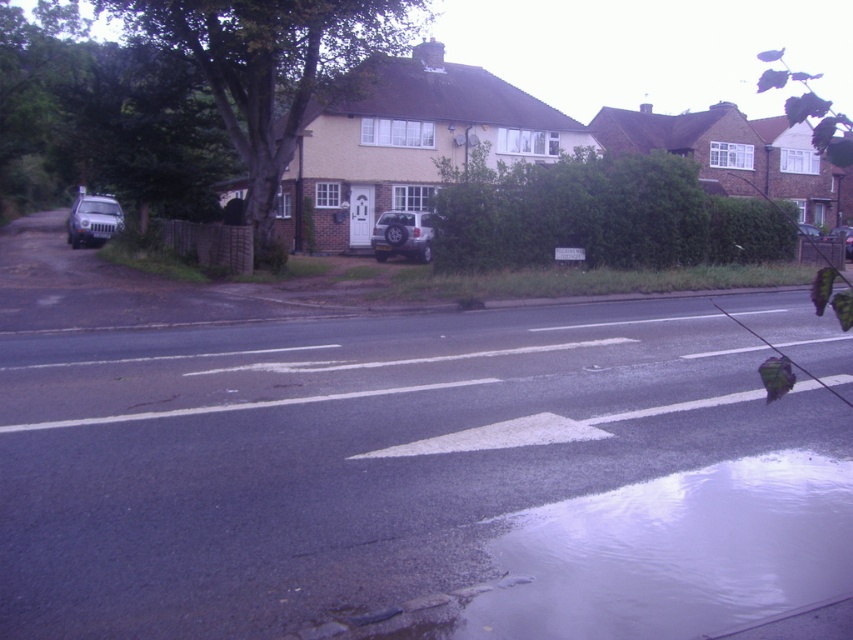
Question: Which object is farther from the camera taking this photo?

Choices:
 (A) metallic silver car at center right
 (B) clear water at lower right

Answer: (A)

Question: Is smooth asphalt road at center to the right of silver metallic suv at center from the viewer's perspective?

Choices:
 (A) no
 (B) yes

Answer: (B)

Question: Among these objects, which one is farthest from the camera?

Choices:
 (A) metallic silver car at center
 (B) metallic silver car at center right

Answer: (A)

Question: Which object appears closest to the camera in this image?

Choices:
 (A) silver metallic suv at center
 (B) satin silver suv at left
 (C) metallic silver car at center right

Answer: (A)

Question: Is clear water at lower right positioned in front of satin silver suv at left?

Choices:
 (A) yes
 (B) no

Answer: (A)

Question: Is clear water at lower right smaller than silver metallic suv at center?

Choices:
 (A) yes
 (B) no

Answer: (B)